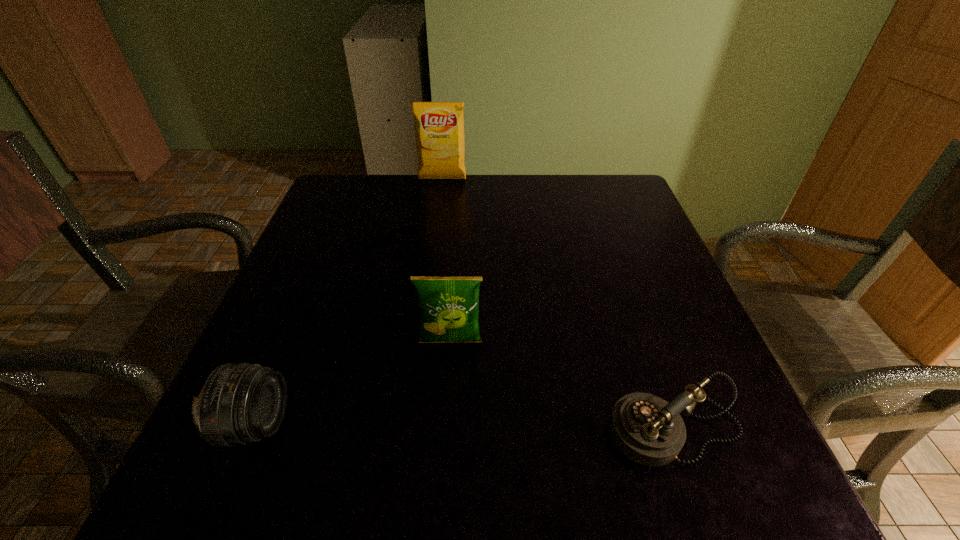
Where is `object situated at the far edge`? The image size is (960, 540). object situated at the far edge is located at coordinates (439, 126).

Locate an element on the screen. This screenshot has width=960, height=540. telephoto lens at the near edge is located at coordinates (239, 403).

This screenshot has width=960, height=540. I want to click on telephone that is at the near edge, so click(647, 429).

Image resolution: width=960 pixels, height=540 pixels. Identify the location of object at the left edge. (239, 403).

Identify the location of object located at the right edge. (647, 429).

Locate an element on the screen. The image size is (960, 540). object positioned at the near left corner is located at coordinates (239, 403).

Locate an element on the screen. The width and height of the screenshot is (960, 540). object situated at the near right corner is located at coordinates (647, 429).

This screenshot has height=540, width=960. I want to click on free space at the far edge of the desktop, so click(x=457, y=215).

Where is `vacant position at the near edge of the desktop`? Image resolution: width=960 pixels, height=540 pixels. vacant position at the near edge of the desktop is located at coordinates (314, 443).

What are the coordinates of `free space at the left edge of the desktop` in the screenshot? It's located at (306, 229).